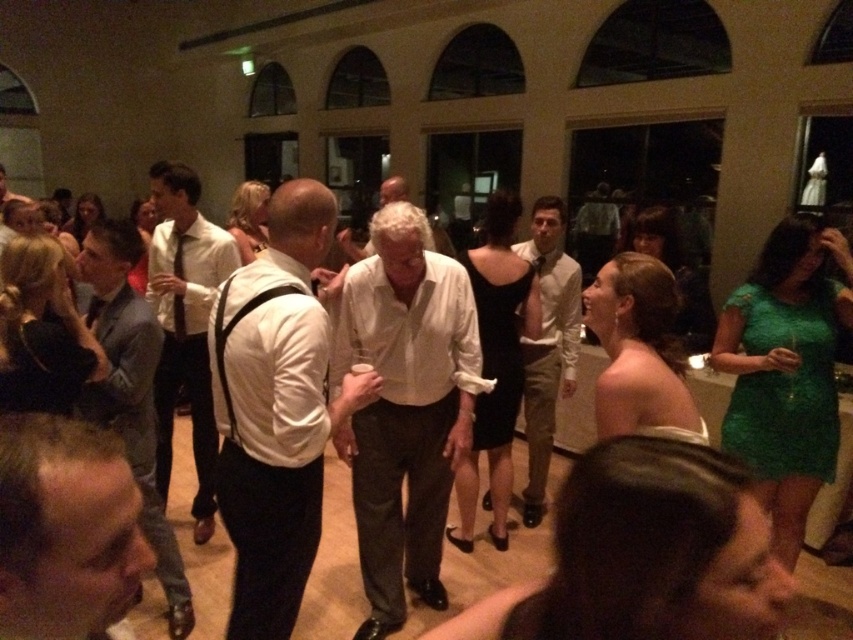
Is white matte shirt at center taller than light beige cotton shirt at center?

No, white matte shirt at center is not taller than light beige cotton shirt at center.

Does white matte shirt at center have a smaller size compared to light beige cotton shirt at center?

Yes.

Who is more forward, [218,364] or [544,278]?

Positioned in front is point [218,364].

Identify the location of white matte shirt at center. (276, 410).

Describe the element at coordinates (405, 406) in the screenshot. The image size is (853, 640). I see `white cotton shirt at center` at that location.

Which is more to the left, white cotton shirt at center or white shirt at center?

From the viewer's perspective, white shirt at center appears more on the left side.

This screenshot has width=853, height=640. What do you see at coordinates (405, 406) in the screenshot?
I see `white cotton shirt at center` at bounding box center [405, 406].

Identify the location of white cotton shirt at center. (405, 406).

Is point (149, 305) positioned in front of point (547, 220)?

Yes, point (149, 305) is in front of point (547, 220).

Can you confirm if light gray suit at center is positioned to the left of light beige cotton shirt at center?

Correct, you'll find light gray suit at center to the left of light beige cotton shirt at center.

Which is in front, point (105, 266) or point (523, 344)?

Positioned in front is point (105, 266).

I want to click on light gray suit at center, so click(131, 392).